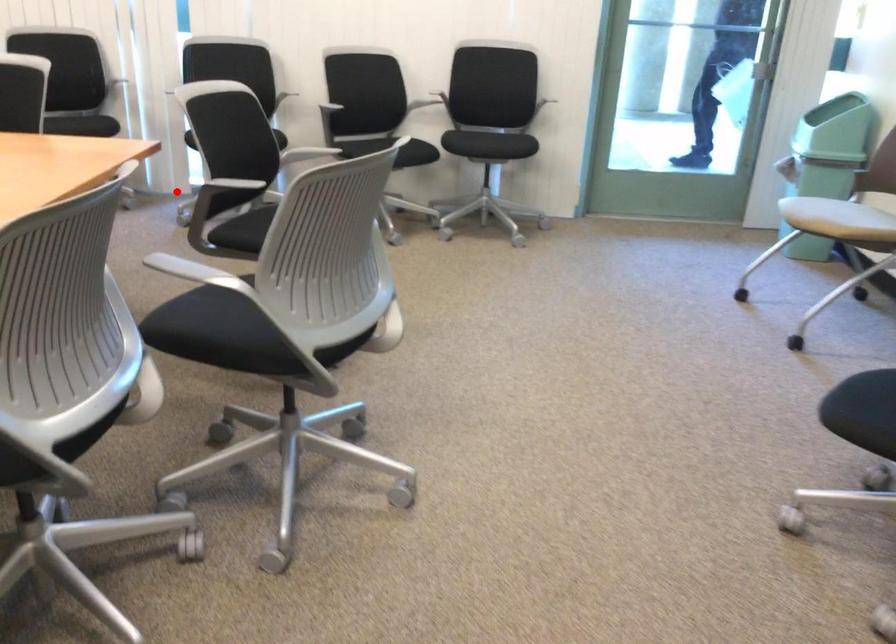
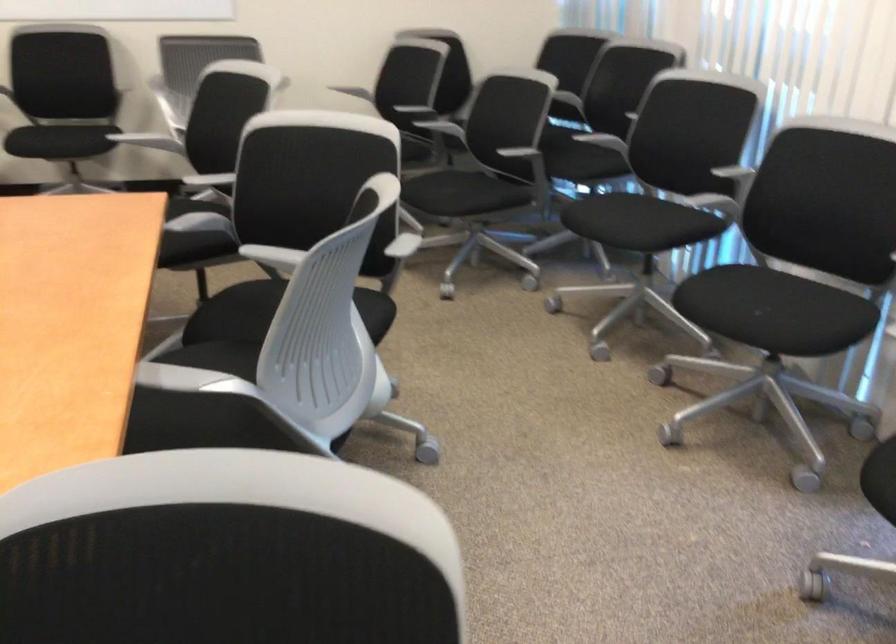
Question: I am providing you with two images of the same scene from different viewpoints. A red point is shown in image1. For the corresponding object point in image2, is it positioned nearer or farther from the camera?

Choices:
 (A) Nearer
 (B) Farther

Answer: (A)